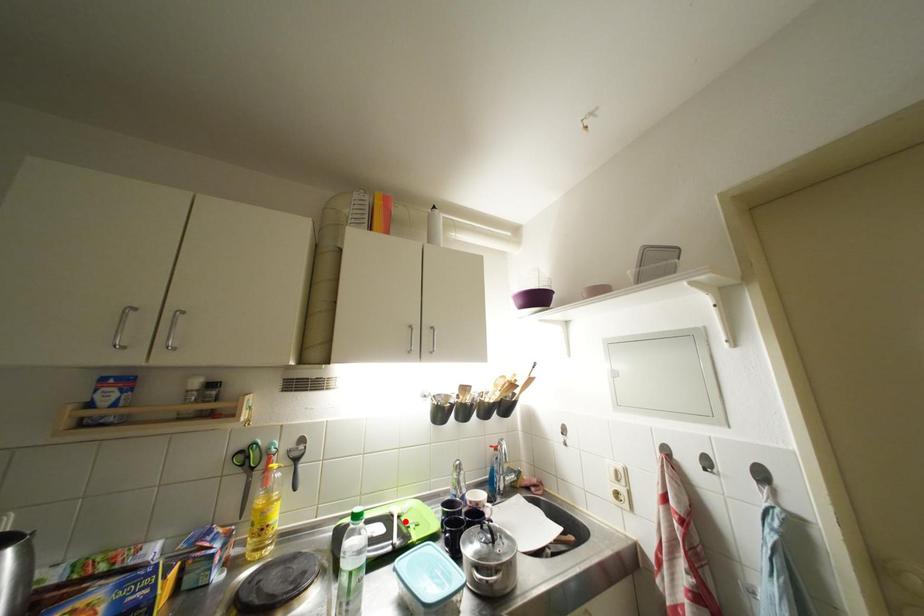
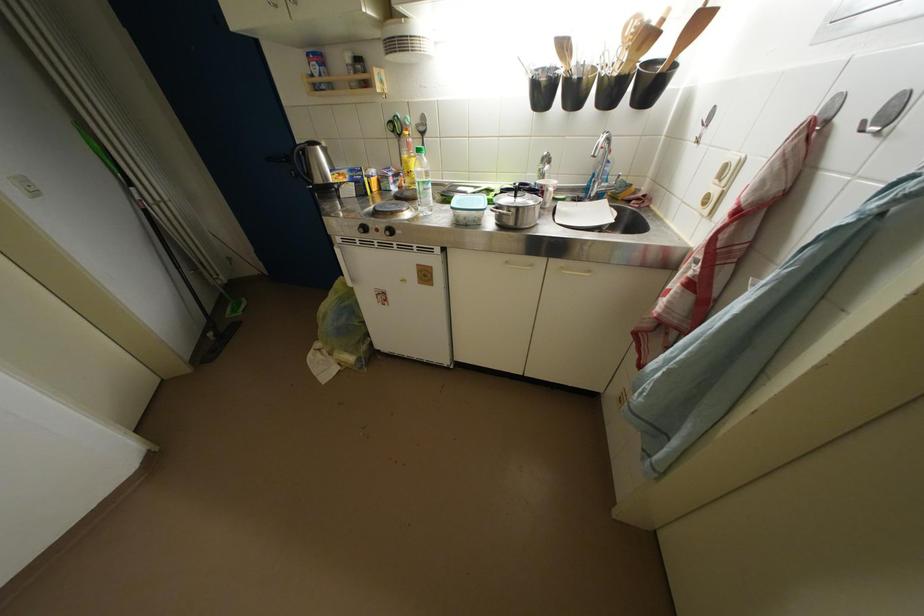
Where in the second image is the point corresponding to the highlighted location from the first image?

(495, 193)